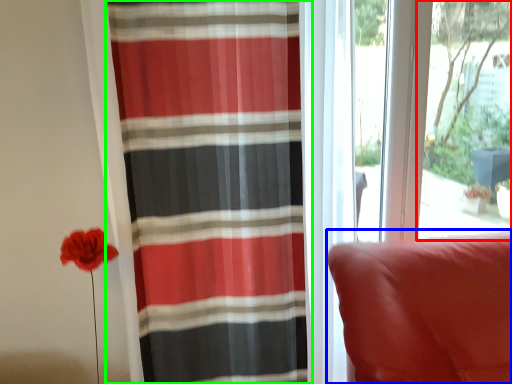
Question: Which object is the closest to the window screen (highlighted by a red box)? Choose among these: furniture (highlighted by a blue box) or curtain (highlighted by a green box).

Choices:
 (A) furniture
 (B) curtain

Answer: (A)